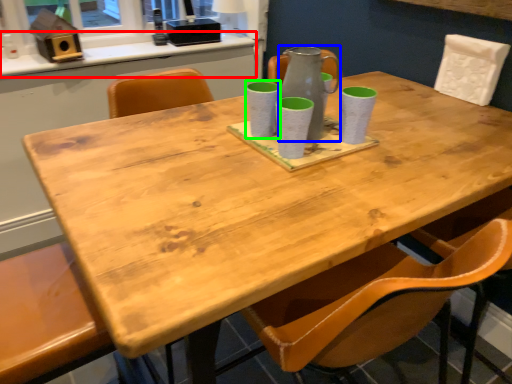
Question: Which object is the closest to the counter top (highlighted by a red box)? Choose among these: glass vase (highlighted by a blue box) or mug (highlighted by a green box).

Choices:
 (A) glass vase
 (B) mug

Answer: (B)